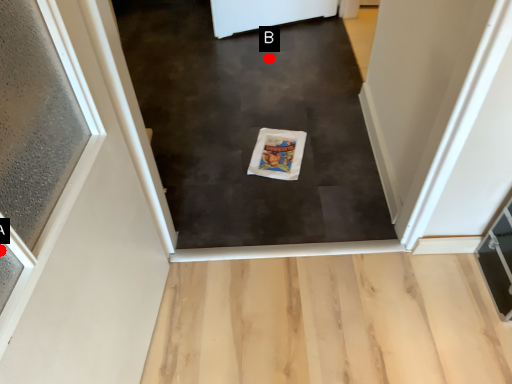
Question: Two points are circled on the image, labeled by A and B beside each circle. Which of the following is the closest to the observer?

Choices:
 (A) A is closer
 (B) B is closer

Answer: (A)